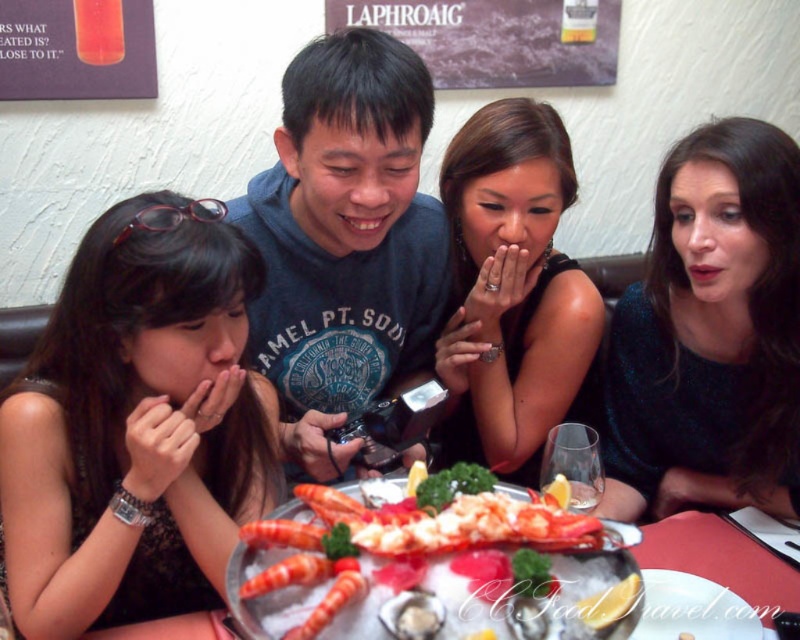
You are standing in front of the table where the four people are sitting. There are two points marked on the table surface. The first point is located at coordinates point (344, 515) and the second point is at point (416, 611). Which point is closer to you?

Point (344, 515) is closer to you because it is further to the camera than point (416, 611).

You are standing at the point labeled point (624, 525) in the image. You want to throw a small ball to a friend who is standing 24 inches away from you. Is your friend within reach?

The distance between you and the friend is 24 inches, which is less than the 26.15 inches between you and the point labeled point (624, 525). Therefore, your friend is within reach.

You are a photographer trying to capture a detailed shot of the shiny red lobster at center. However, the matte black dress at left is partially blocking your view. Based on the scene description, can you determine if the lobster will be fully visible in your photo?

The shiny red lobster at center has a greater width than the matte black dress at left. Since the lobster is wider, it is likely that the lobster will extend beyond the dress, making it fully visible in the photo.